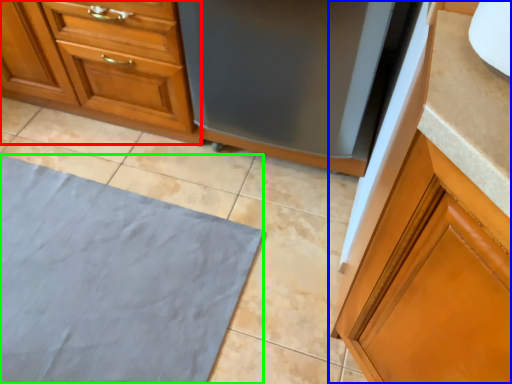
Question: Based on their relative distances, which object is nearer to cabinetry (highlighted by a red box)? Choose from cabinetry (highlighted by a blue box) and bath mat (highlighted by a green box).

Choices:
 (A) cabinetry
 (B) bath mat

Answer: (B)